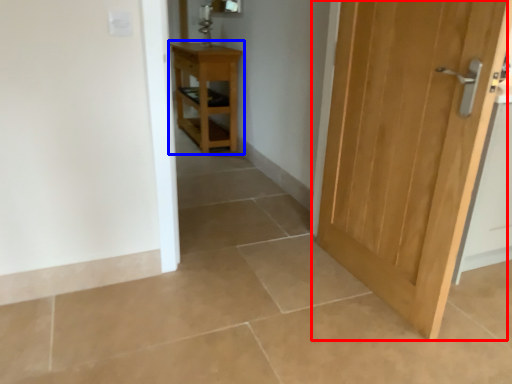
Question: Which of the following is the closest to the observer, door (highlighted by a red box) or nightstand (highlighted by a blue box)?

Choices:
 (A) door
 (B) nightstand

Answer: (A)